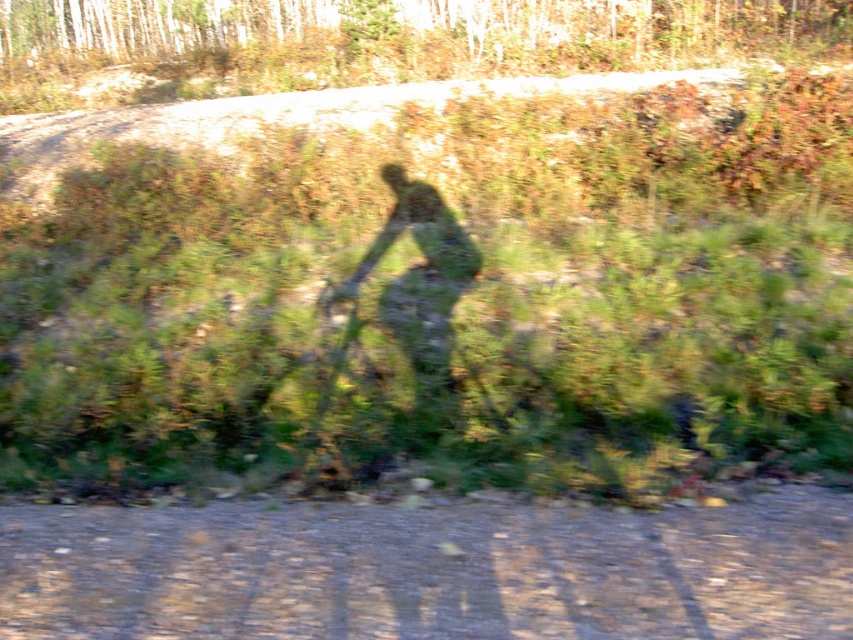
Which is more to the left, brown gravel dirt track at lower center or green matte figure at center?

Positioned to the left is green matte figure at center.

Does brown gravel dirt track at lower center appear on the right side of green matte figure at center?

Correct, you'll find brown gravel dirt track at lower center to the right of green matte figure at center.

The height and width of the screenshot is (640, 853). What do you see at coordinates (428, 572) in the screenshot?
I see `brown gravel dirt track at lower center` at bounding box center [428, 572].

Locate an element on the screen. brown gravel dirt track at lower center is located at coordinates (428, 572).

Who is shorter, green leafy grass at center or green matte figure at center?

Standing shorter between the two is green matte figure at center.

Does point (561, 253) come behind point (393, 227)?

No, it is in front of (393, 227).

Locate an element on the screen. green leafy grass at center is located at coordinates (445, 298).

Does green leafy grass at center appear under brown gravel dirt track at lower center?

Incorrect, green leafy grass at center is not positioned below brown gravel dirt track at lower center.

Is point (657, 372) farther from viewer compared to point (602, 554)?

That is True.

Which is behind, point (850, 211) or point (15, 545)?

Point (850, 211)

Where is `green leafy grass at center`? This screenshot has width=853, height=640. green leafy grass at center is located at coordinates (445, 298).